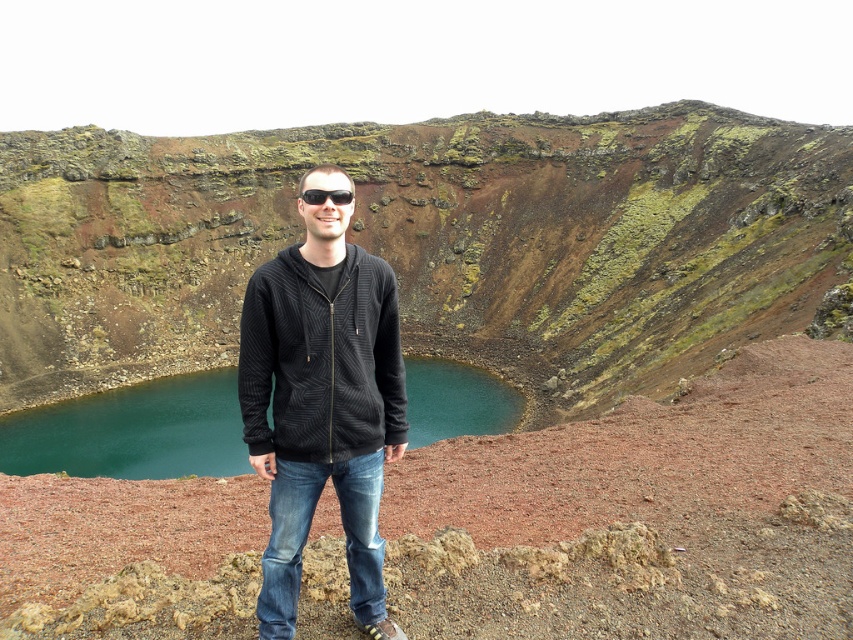
You are a photographer planning to take a photo of the volcanic crater Keri? in Iceland. You want to ensure both the person at point (560, 227) and the water body at point (310, 464) are in focus. Which point should you focus on first to ensure the foreground is sharp?

You should focus on point (560, 227) first because it is closer to the camera than point (310, 464), ensuring the foreground is sharp.

You are a photographer aiming to capture the person in the image while ensuring both the black textured hoodie at center and the black plastic sunglasses at center are clearly visible. Which object should you focus on first to ensure the subject is in sharp focus?

The black plastic sunglasses at center should be focused on first because they are located above the black textured hoodie at center, meaning they are closer to the camera. Focusing on the sunglasses will ensure the subject is in sharp focus since they are positioned nearer to the camera than the hoodie.

You are planning to take a photo of the volcanic crater Keri? in Iceland. You want to ensure the black textured hoodie at center is visible in the foreground while capturing the turquoise crater lake in the background. Based on their positions, is this possible?

The black textured hoodie at center is positioned at point (322, 406), which places it in the foreground, allowing the turquoise crater lake to be visible in the background. Yes, this composition is possible.